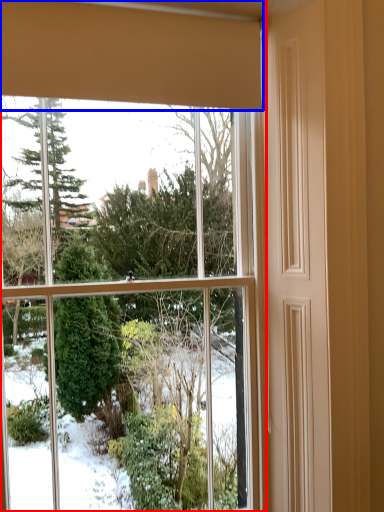
Question: Which object appears closest to the camera in this image, window (highlighted by a red box) or curtain (highlighted by a blue box)?

Choices:
 (A) window
 (B) curtain

Answer: (B)